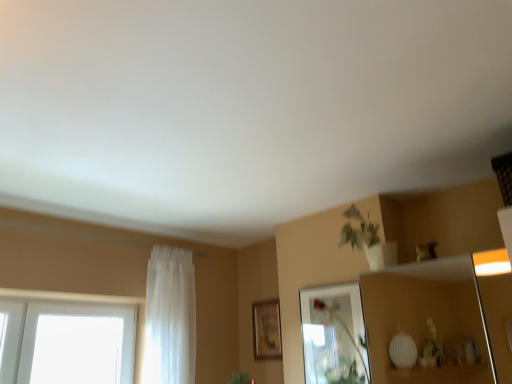
Question: Considering their positions, is white sheer curtain at left located in front of or behind wooden picture frame at center?

Choices:
 (A) front
 (B) behind

Answer: (A)

Question: Visually, is white sheer curtain at left positioned to the left or to the right of wooden picture frame at center?

Choices:
 (A) right
 (B) left

Answer: (B)

Question: Which is nearer to the white sheer curtain at left?

Choices:
 (A) wooden picture frame at center
 (B) clear glass mirror at upper center

Answer: (A)

Question: Considering the real-world distances, which object is farthest from the wooden picture frame at center?

Choices:
 (A) clear glass mirror at upper center
 (B) white sheer curtain at left

Answer: (B)